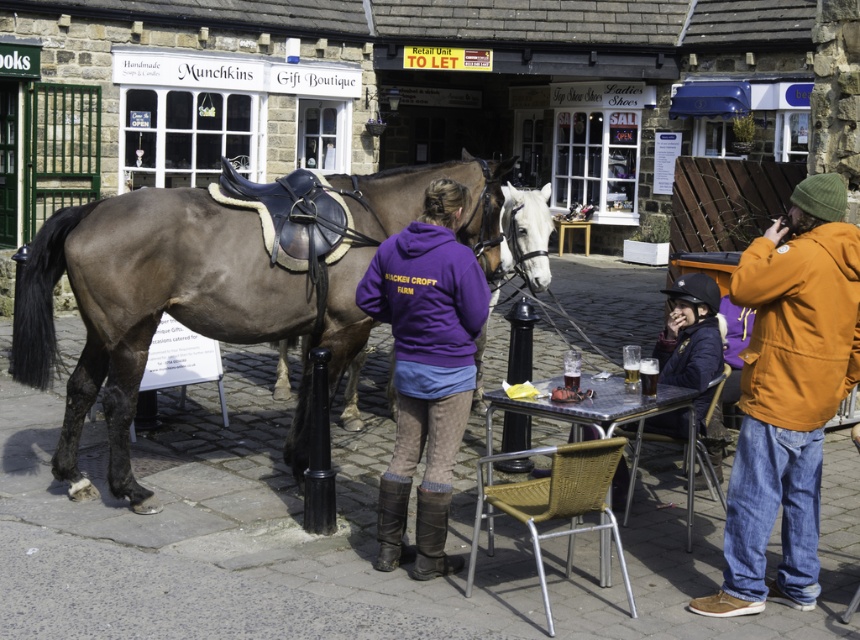
Question: Is brown leather saddle at center in front of purple fleece at center?

Choices:
 (A) no
 (B) yes

Answer: (A)

Question: Which point appears farthest from the camera in this image?

Choices:
 (A) pyautogui.click(x=609, y=387)
 (B) pyautogui.click(x=771, y=419)

Answer: (A)

Question: Does orange fleece jacket at right lie behind purple fleece at center?

Choices:
 (A) no
 (B) yes

Answer: (A)

Question: Which object appears farthest from the camera in this image?

Choices:
 (A) purple fleece at center
 (B) brown leather saddle at center
 (C) orange fleece jacket at right
 (D) metallic silver table at lower center

Answer: (B)

Question: Among these objects, which one is farthest from the camera?

Choices:
 (A) orange fleece jacket at right
 (B) brown leather saddle at center
 (C) metallic silver table at lower center

Answer: (B)

Question: Can you confirm if orange fleece jacket at right is thinner than metallic silver table at lower center?

Choices:
 (A) no
 (B) yes

Answer: (B)